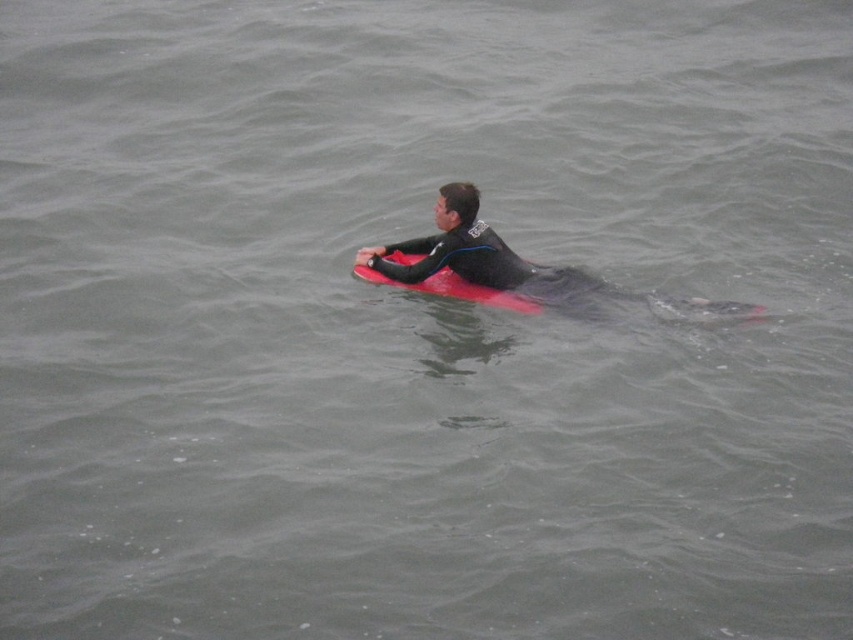
From the picture: You are a photographer trying to capture the person on the board. Since the matte black wetsuit at center and the rubber matte surfboard at center are both in the frame, which one will appear bigger in your photo?

The matte black wetsuit at center appears bigger in the photo because it has a larger size compared to the rubber matte surfboard at center.

You are a photographer trying to capture the person on the board. If you want to ensure both the matte black wetsuit at center and the rubber matte surfboard at center are fully visible in your shot, which object should you focus on to frame the composition properly?

The matte black wetsuit at center has a larger width than the rubber matte surfboard at center, so focusing on the matte black wetsuit at center will ensure both objects are fully visible in the frame.

You are a photographer positioned 30 feet away from the water. You want to capture a closeup shot of the matte black wetsuit at center. Can you move closer to achieve this without entering the water?

The matte black wetsuit at center is currently 26.83 feet away from the camera. Since you are already positioned 30 feet away from the water, moving closer would require approaching the water edge. However, the total distance from you to the wetsuit would then be less than 30 feet minus your movement distance. To ensure the wetsuit is within your desired closeup range, you can move closer to the water edge as long as the total distance remains within your camera lens capability. However, the exact closeness